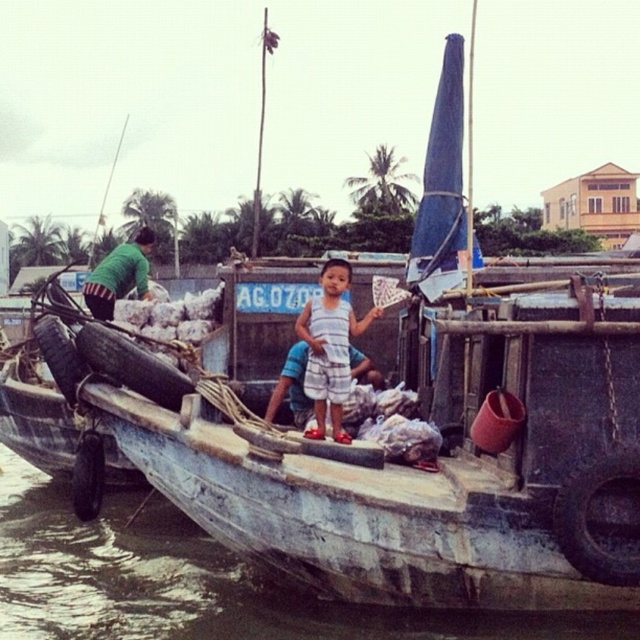
Is smooth concrete boat at center bigger than striped shorts at center?

Indeed, smooth concrete boat at center has a larger size compared to striped shorts at center.

Is smooth concrete boat at center further to camera compared to striped shorts at center?

No, smooth concrete boat at center is in front of striped shorts at center.

Find the location of a particular element. The height and width of the screenshot is (640, 640). smooth concrete boat at center is located at coordinates pyautogui.click(x=193, y=582).

Is smooth concrete boat at center smaller than green fabric shirt at left?

Actually, smooth concrete boat at center might be larger than green fabric shirt at left.

What do you see at coordinates (193, 582) in the screenshot? I see `smooth concrete boat at center` at bounding box center [193, 582].

The width and height of the screenshot is (640, 640). What are the coordinates of `smooth concrete boat at center` in the screenshot? It's located at (193, 582).

Who is positioned more to the right, striped shorts at center or green fabric shirt at left?

Positioned to the right is striped shorts at center.

Between striped shorts at center and green fabric shirt at left, which one is positioned lower?

striped shorts at center

Where is `striped shorts at center`? striped shorts at center is located at coordinates (330, 348).

Where is `striped shorts at center`? striped shorts at center is located at coordinates (330, 348).